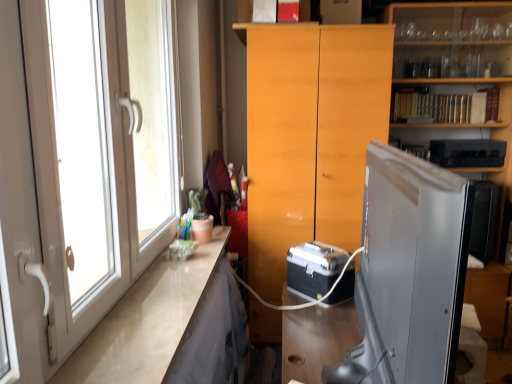
At what (x,y) coordinates should I click in order to perform the action: click on free point above white glossy counter top at left (from a real-world perspective). Please return your answer as a coordinate pair (x, y). Looking at the image, I should click on (168, 287).